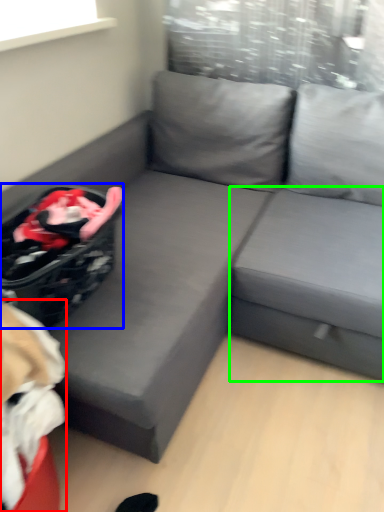
Question: Which is nearer to the bean bag chair (highlighted by a red box)? laundry basket (highlighted by a blue box) or table (highlighted by a green box).

Choices:
 (A) laundry basket
 (B) table

Answer: (A)